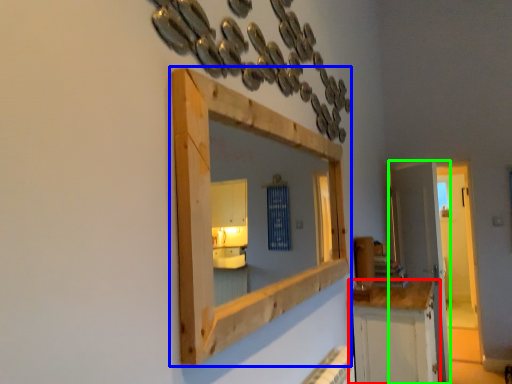
Question: Estimate the real-world distances between objects in this image. Which object is farther from cabinetry (highlighted by a red box), medicine cabinet (highlighted by a blue box) or door (highlighted by a green box)?

Choices:
 (A) medicine cabinet
 (B) door

Answer: (B)